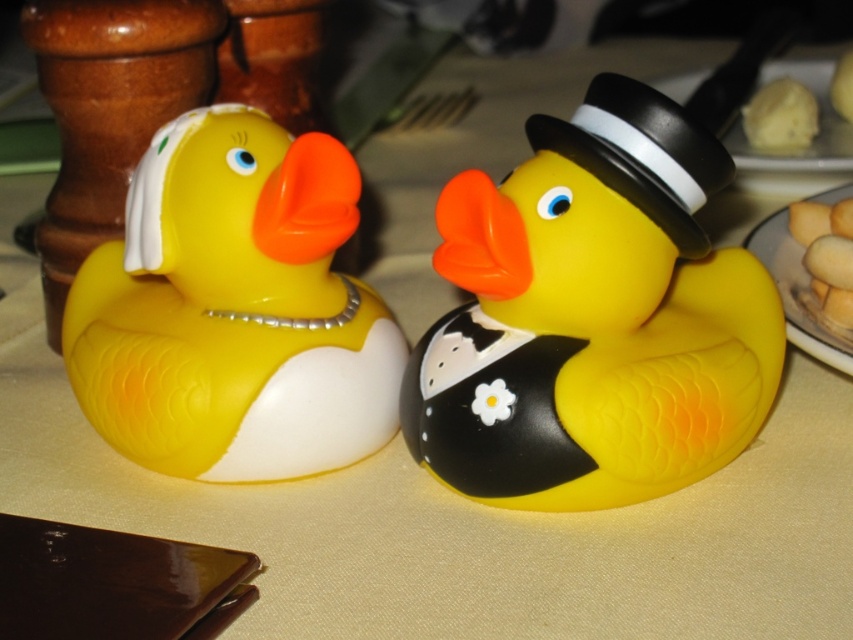
Question: Which point appears closest to the camera in this image?

Choices:
 (A) (682, 220)
 (B) (784, 116)
 (C) (822, 316)

Answer: (A)

Question: Does black matte dress hat at upper right have a larger size compared to yellow sponge cake at upper right?

Choices:
 (A) no
 (B) yes

Answer: (B)

Question: Observing the image, what is the correct spatial positioning of rubber yellow duck at center in reference to golden sponge cake at right?

Choices:
 (A) right
 (B) left

Answer: (B)

Question: Does matte rubber duck at left appear under matte white porcelain at right?

Choices:
 (A) yes
 (B) no

Answer: (A)

Question: Which of the following is the farthest from the observer?

Choices:
 (A) matte white porcelain at right
 (B) golden sponge cake at right

Answer: (B)

Question: Which point is farther to the camera?

Choices:
 (A) matte white porcelain at right
 (B) black matte dress hat at upper right
 (C) white fluffy cake at upper right
 (D) rubber yellow duck at center

Answer: (C)